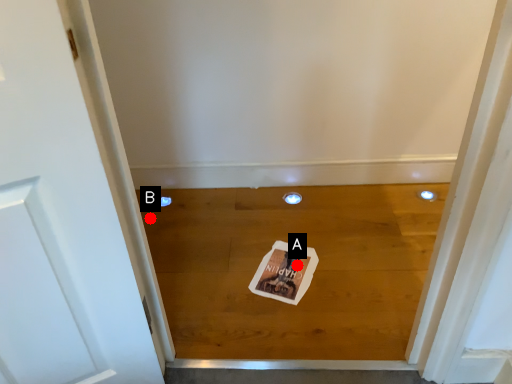
Question: Two points are circled on the image, labeled by A and B beside each circle. Which point appears closest to the camera in this image?

Choices:
 (A) A is closer
 (B) B is closer

Answer: (A)